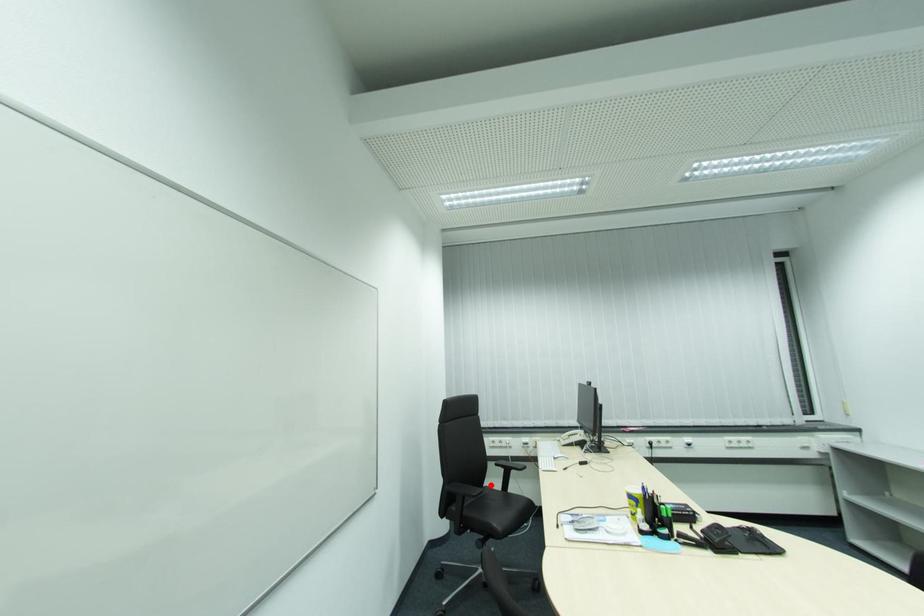
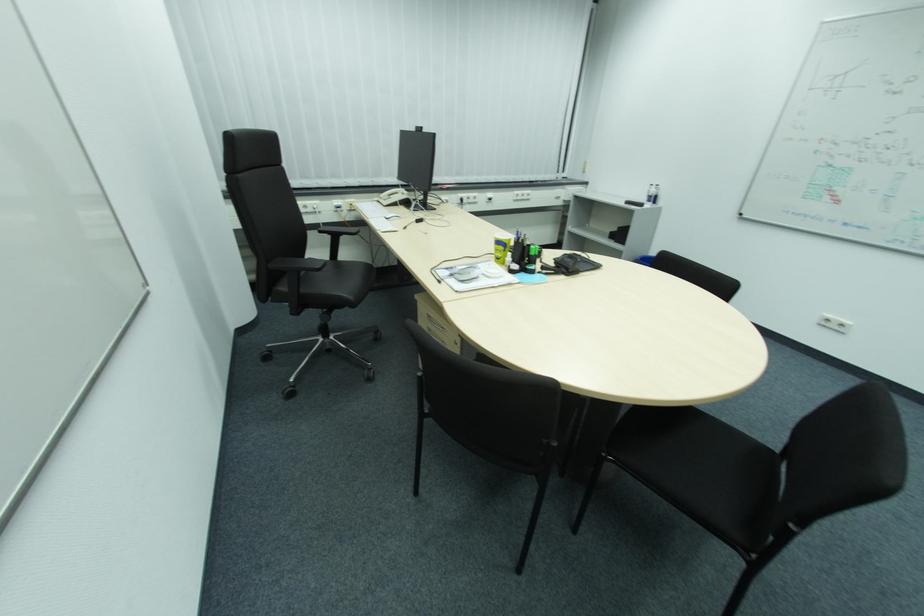
The point at the highlighted location is marked in the first image. Where is the corresponding point in the second image?

(311, 257)